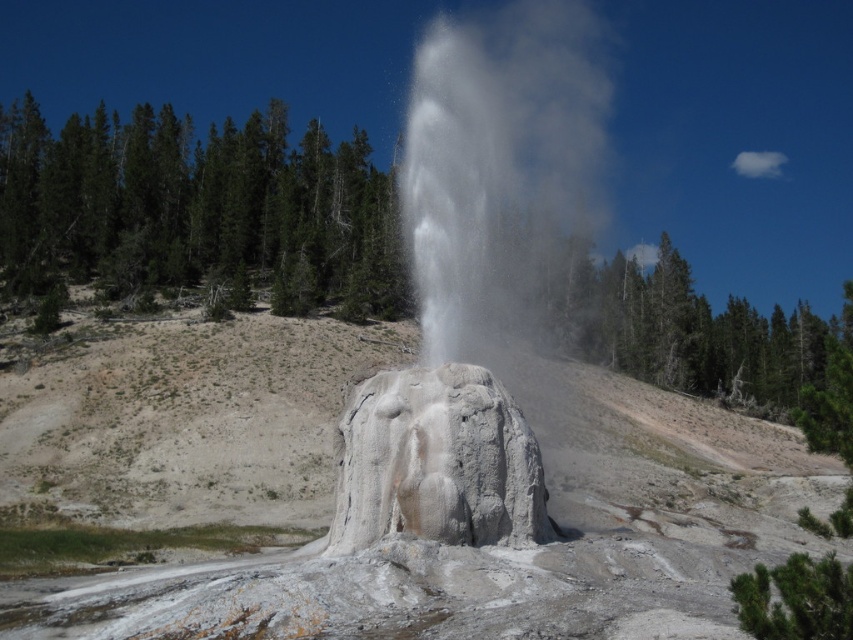
Based on the photo, which of these two, white stone geyser at center or white textured rock at center, stands shorter?

white textured rock at center is shorter.

Identify the location of white stone geyser at center. (463, 292).

Does point (415, 394) come in front of point (386, 449)?

No.

The height and width of the screenshot is (640, 853). I want to click on white stone geyser at center, so click(x=463, y=292).